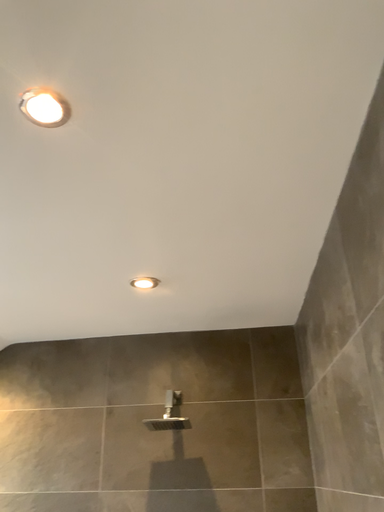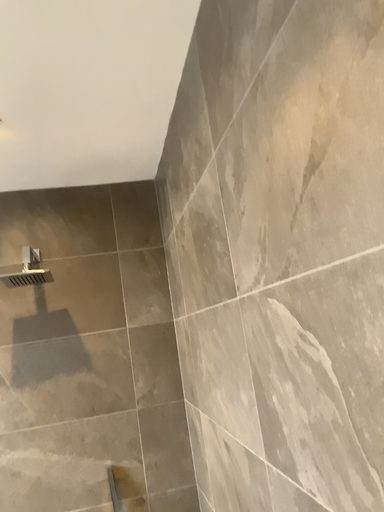
Question: How did the camera likely rotate when shooting the video?

Choices:
 (A) rotated left
 (B) rotated right

Answer: (B)